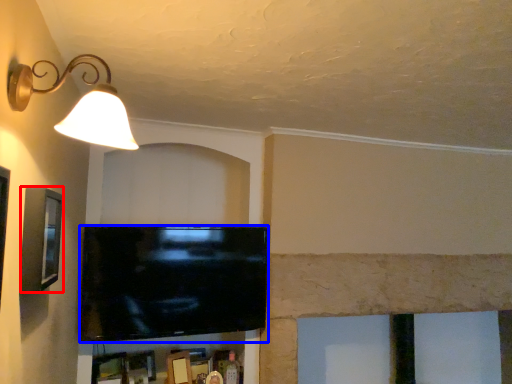
Question: Among these objects, which one is farthest to the camera, picture frame (highlighted by a red box) or television (highlighted by a blue box)?

Choices:
 (A) picture frame
 (B) television

Answer: (B)